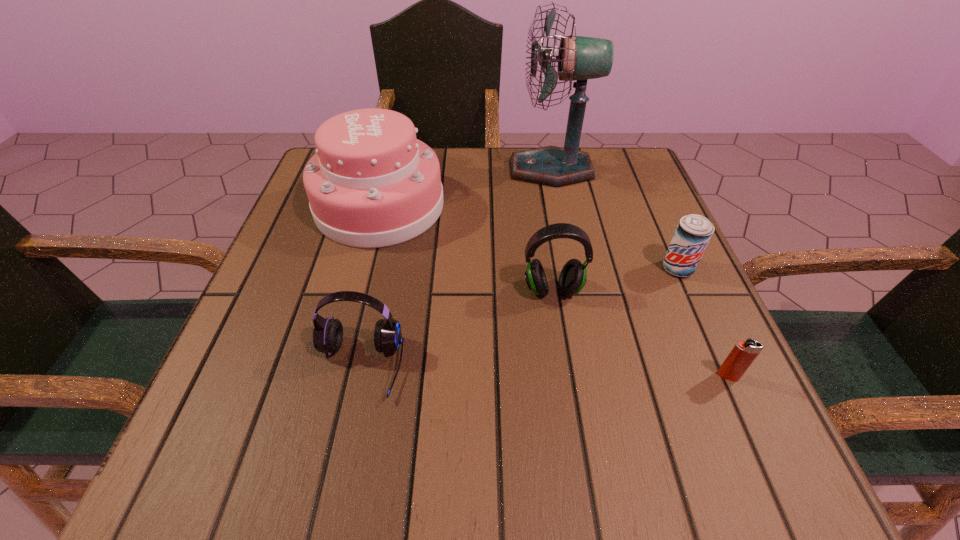
Identify which object is located as the fourth nearest to the tallest object. Please provide its 2D coordinates. Your answer should be formatted as a tuple, i.e. [(x, y)], where the tuple contains the x and y coordinates of a point satisfying the conditions above.

[(328, 333)]

I want to click on vacant position in the image that satisfies the following two spatial constraints: 1. on the front side of the beer can; 2. on the right side of the birthday cake, so click(x=364, y=268).

Locate an element on the screen. vacant space that satisfies the following two spatial constraints: 1. in front of the igniter where the wind blows; 2. on the right side of the tallest object is located at coordinates (593, 376).

Where is `vacant space that satisfies the following two spatial constraints: 1. in front of the tallest object where the wind blows; 2. on the ear cushions of the nearer headset`? Image resolution: width=960 pixels, height=540 pixels. vacant space that satisfies the following two spatial constraints: 1. in front of the tallest object where the wind blows; 2. on the ear cushions of the nearer headset is located at coordinates (591, 367).

The image size is (960, 540). I want to click on vacant space that satisfies the following two spatial constraints: 1. in front of the tallest object where the wind blows; 2. on the ear cushions of the nearer headset, so click(x=591, y=367).

Where is `free location that satisfies the following two spatial constraints: 1. on the back side of the shortest object; 2. in front of the tallest object where the wind blows`? This screenshot has width=960, height=540. free location that satisfies the following two spatial constraints: 1. on the back side of the shortest object; 2. in front of the tallest object where the wind blows is located at coordinates (636, 170).

At what (x,y) coordinates should I click in order to perform the action: click on vacant space that satisfies the following two spatial constraints: 1. in front of the beer can where the wind blows; 2. on the left side of the fan. Please return your answer as a coordinate pair (x, y). Looking at the image, I should click on (571, 268).

Locate an element on the screen. free location that satisfies the following two spatial constraints: 1. in front of the fan where the wind blows; 2. on the ear cushions of the nearer headset is located at coordinates (591, 367).

At what (x,y) coordinates should I click in order to perform the action: click on blank area in the image that satisfies the following two spatial constraints: 1. on the back side of the beer can; 2. in front of the fan where the wind blows. Please return your answer as a coordinate pair (x, y). The image size is (960, 540). Looking at the image, I should click on point(635,170).